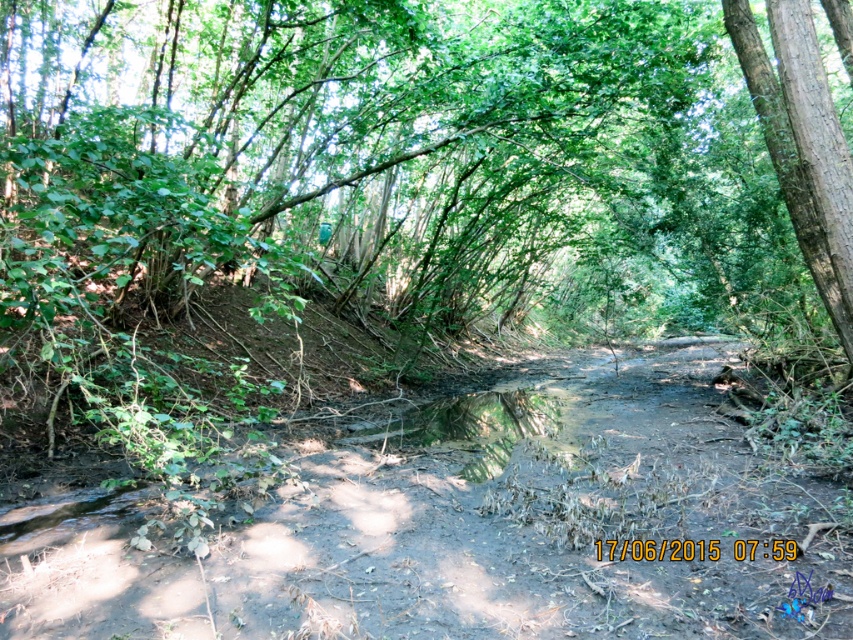
Question: Does brown dirt track at center appear on the right side of smooth brown tree trunk at right?

Choices:
 (A) no
 (B) yes

Answer: (A)

Question: Which of the following is the farthest from the observer?

Choices:
 (A) (752, 93)
 (B) (590, 598)

Answer: (A)

Question: Among these points, which one is nearest to the camera?

Choices:
 (A) (692, 508)
 (B) (813, 246)

Answer: (A)

Question: Is brown dirt track at center behind smooth brown tree trunk at right?

Choices:
 (A) yes
 (B) no

Answer: (B)

Question: Is brown dirt track at center above smooth brown tree trunk at right?

Choices:
 (A) no
 (B) yes

Answer: (A)

Question: Among these points, which one is farthest from the camera?

Choices:
 (A) (843, 333)
 (B) (715, 397)

Answer: (B)